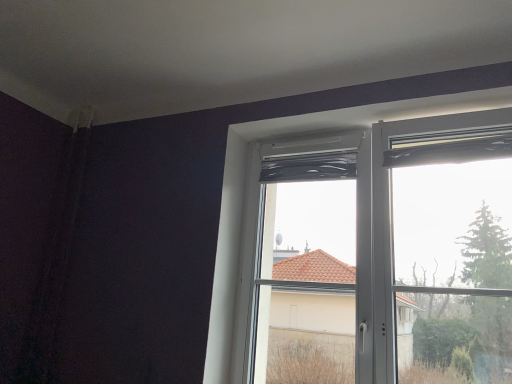
You are a GUI agent. You are given a task and a screenshot of the screen. Output one action in this format:
    pyautogui.click(x=<x>, y=<y>)
    Task: Click on the metallic gray window at center
    
    Given the screenshot: What is the action you would take?
    pyautogui.click(x=359, y=222)

What do you see at coordinates (359, 222) in the screenshot? The image size is (512, 384). I see `metallic gray window at center` at bounding box center [359, 222].

Find the location of `metallic gray window at center`. metallic gray window at center is located at coordinates (359, 222).